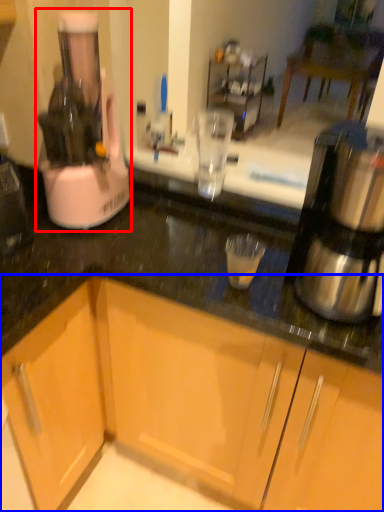
Question: Which of the following is the closest to the observer, home appliance (highlighted by a red box) or cabinetry (highlighted by a blue box)?

Choices:
 (A) home appliance
 (B) cabinetry

Answer: (B)